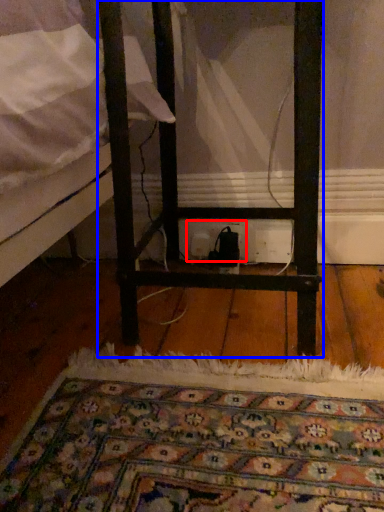
Question: Which object appears closest to the camera in this image, electric outlet (highlighted by a red box) or furniture (highlighted by a blue box)?

Choices:
 (A) electric outlet
 (B) furniture

Answer: (B)